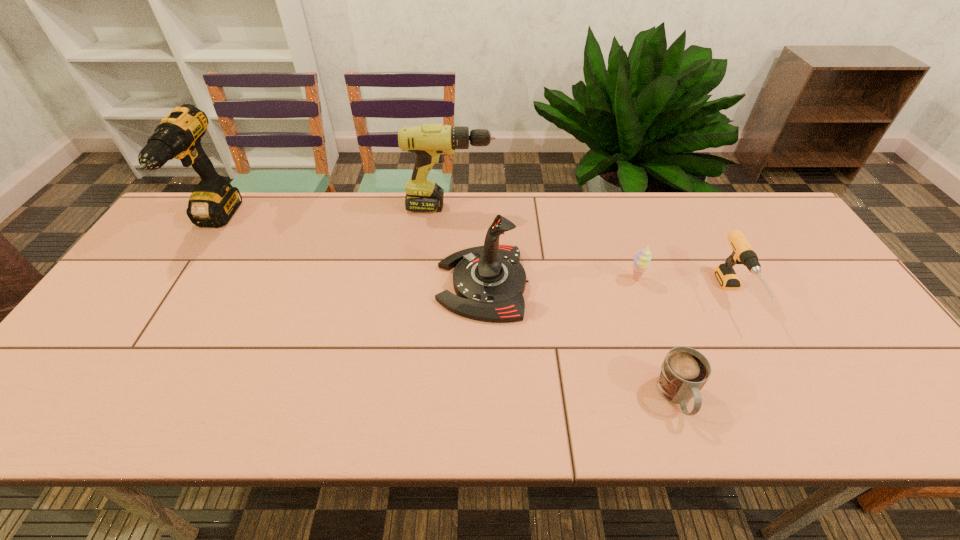
Where is `vacant space that satisfies the following two spatial constraints: 1. on the front side of the sherbert; 2. on the handle side of the third tallest object`? The image size is (960, 540). vacant space that satisfies the following two spatial constraints: 1. on the front side of the sherbert; 2. on the handle side of the third tallest object is located at coordinates (637, 284).

Find the location of `free spot that satisfies the following two spatial constraints: 1. at the tip of the leftmost object; 2. on the left side of the sherbert`. free spot that satisfies the following two spatial constraints: 1. at the tip of the leftmost object; 2. on the left side of the sherbert is located at coordinates (177, 278).

You are a GUI agent. You are given a task and a screenshot of the screen. Output one action in this format:
    pyautogui.click(x=<x>, y=<y>)
    Task: Click on the vacant region that satisfies the following two spatial constraints: 1. at the tip of the leftmost drill; 2. on the left side of the sherbert
    The height and width of the screenshot is (540, 960).
    Given the screenshot: What is the action you would take?
    pyautogui.click(x=177, y=278)

Find the location of a particular element. This screenshot has height=540, width=960. vacant space that satisfies the following two spatial constraints: 1. on the handle side of the second drill from right to left; 2. at the tip of the leftmost drill is located at coordinates (449, 222).